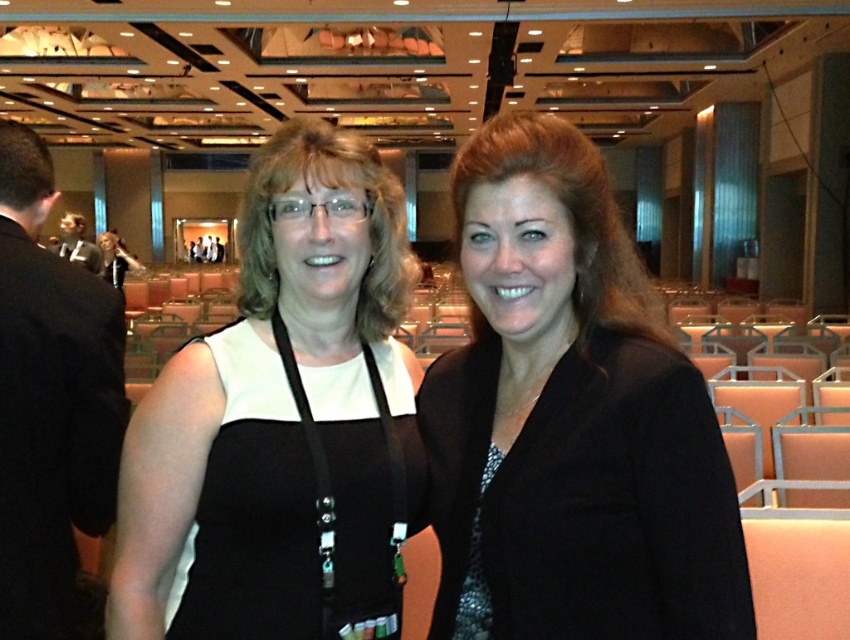
You are a photographer adjusting the camera settings to capture a clear photo of the black fabric dress at center and the black fabric lanyard at center. Since both objects are black, you need to ensure they are distinguishable in the final image. Given their distance apart, can you confirm if the camera can clearly separate these two objects in the photo?

The black fabric dress at center is 4.04 centimeters from the black fabric lanyard at center. Since the distance between them is measurable, the camera should be able to distinguish the two black objects as separate in the photo.

You are a photographer at a conference. You need to decide which item to focus on first between the black textured blazer at center and the black beaded necklace at center. Which one is larger and should be prioritized for focus?

The black textured blazer at center is bigger than the black beaded necklace at center, so you should prioritize focusing on the black textured blazer at center first.

You are a photographer at a conference and notice two accessories at the center of the image. Which one is bigger between the black fabric lanyard at center and the black beaded necklace at center?

The black fabric lanyard at center is larger in size than the black beaded necklace at center.